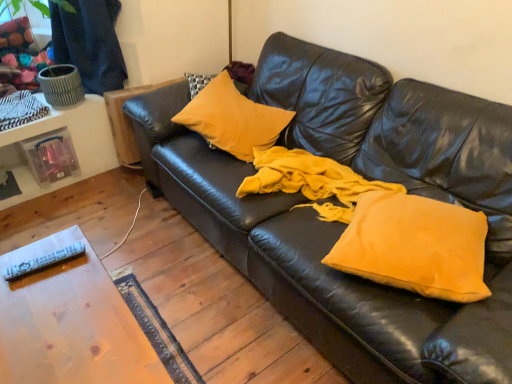
Question: Considering the positions of matte yellow pillow at center, placed as the second pillow when sorted from front to back, and matte yellow pillow at center, acting as the second pillow starting from the back, in the image, is matte yellow pillow at center, placed as the second pillow when sorted from front to back, bigger or smaller than matte yellow pillow at center, acting as the second pillow starting from the back,?

Choices:
 (A) small
 (B) big

Answer: (B)

Question: Do you think matte yellow pillow at center, placed as the 2th pillow when sorted from bottom to top, is within matte yellow pillow at center, marked as the first pillow in a bottom-to-top arrangement, or outside of it?

Choices:
 (A) inside
 (B) outside

Answer: (B)

Question: Based on their relative distances, which object is nearer to the matte yellow pillow at center, placed as the second pillow when sorted from front to back?

Choices:
 (A) matte yellow pillow at center, the 2th pillow from the top
 (B) white plastic remote at lower left
 (C) wooden table at lower left

Answer: (A)

Question: Which of these objects is positioned farthest from the matte yellow pillow at center, placed as the first pillow when sorted from left to right?

Choices:
 (A) white plastic remote at lower left
 (B) matte yellow pillow at center, acting as the second pillow starting from the back
 (C) wooden table at lower left

Answer: (A)